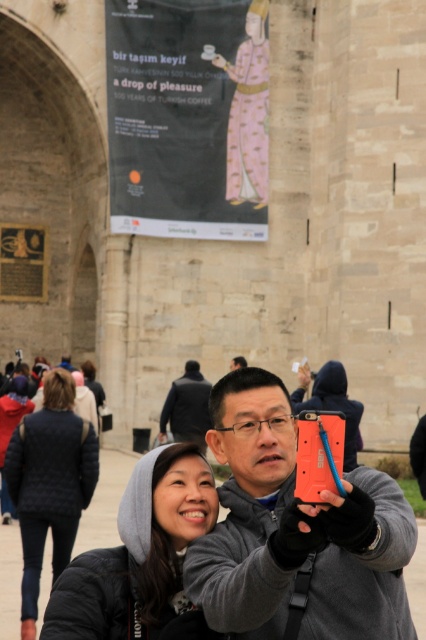
You are standing at the camera position and want to reach the point marked at coordinates (204, 474). If your walking speed is 3 feet per second, how many seconds will it take you to reach that point?

The point marked at coordinates (204, 474) is 112.70 feet away from the camera. At a walking speed of 3 feet per second, it will take approximately 37.57 seconds to reach the point.

You are standing in front of the historic stone structure and see the gray hoodie at center and the quilted black jacket at lower left. Which clothing item is positioned to the right of the other?

The gray hoodie at center is positioned to the right of the quilted black jacket at lower left.